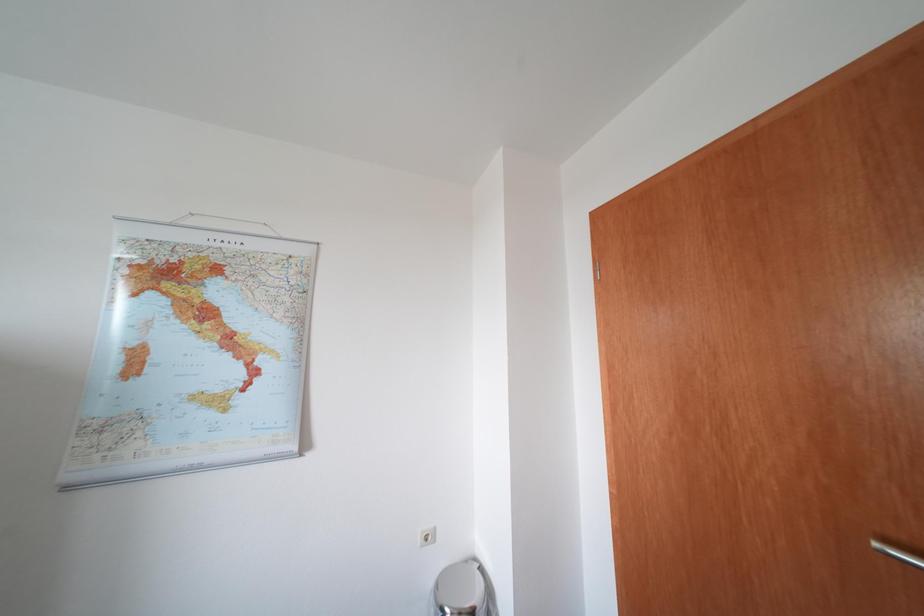
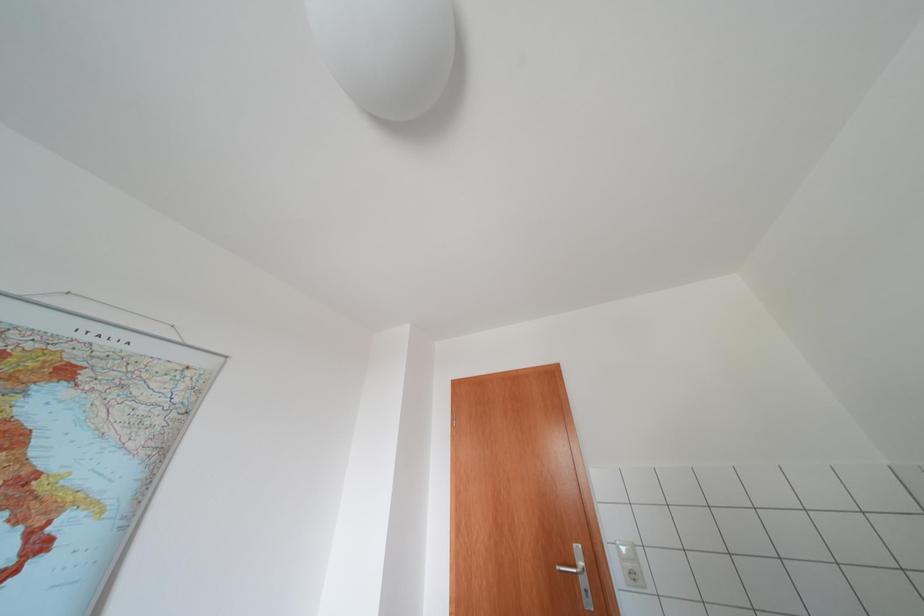
Based on the continuous images, in which direction is the camera rotating?

The camera rotated toward right-up.